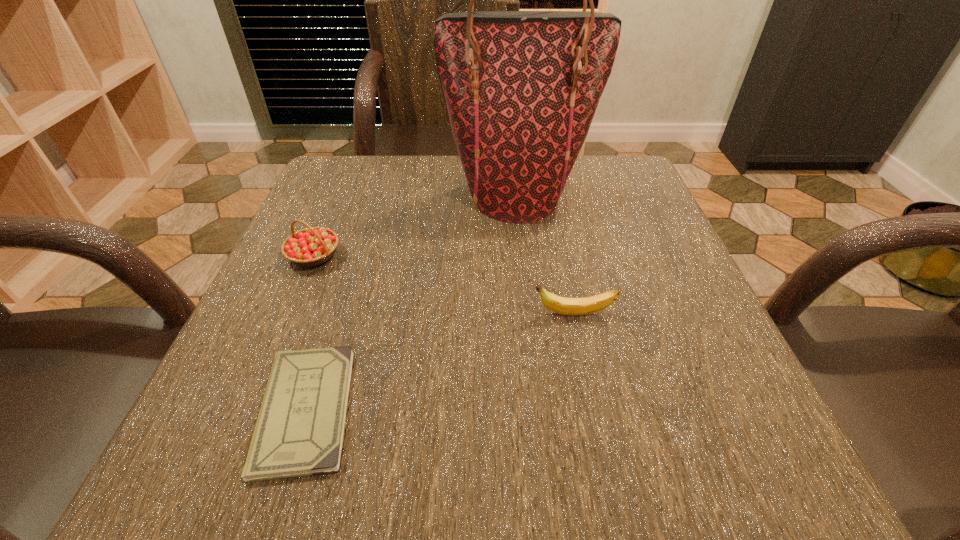
Find the location of a particular element. object that is at the near left corner is located at coordinates (300, 429).

The image size is (960, 540). What are the coordinates of `object that is positioned at the far right corner` in the screenshot? It's located at (521, 87).

In the image, there is a desktop. At what (x,y) coordinates should I click in order to perform the action: click on vacant region at the far edge. Please return your answer as a coordinate pair (x, y). Looking at the image, I should click on (431, 201).

You are a GUI agent. You are given a task and a screenshot of the screen. Output one action in this format:
    pyautogui.click(x=<x>, y=<y>)
    Task: Click on the free space at the near edge of the desktop
    
    Given the screenshot: What is the action you would take?
    pyautogui.click(x=559, y=426)

Image resolution: width=960 pixels, height=540 pixels. In order to click on vacant space at the left edge in this screenshot , I will do `click(212, 381)`.

In the image, there is a desktop. At what (x,y) coordinates should I click in order to perform the action: click on free space at the right edge. Please return your answer as a coordinate pair (x, y). Image resolution: width=960 pixels, height=540 pixels. Looking at the image, I should click on (637, 261).

Identify the location of vacant space at the far left corner of the desktop. This screenshot has width=960, height=540. (333, 174).

Find the location of a particular element. The height and width of the screenshot is (540, 960). free space at the far right corner of the desktop is located at coordinates (586, 195).

Locate an element on the screen. The height and width of the screenshot is (540, 960). vacant space that is in between the tallest object and the shortest object is located at coordinates (411, 303).

The height and width of the screenshot is (540, 960). I want to click on vacant space that is in between the shortest object and the tallest object, so click(x=411, y=303).